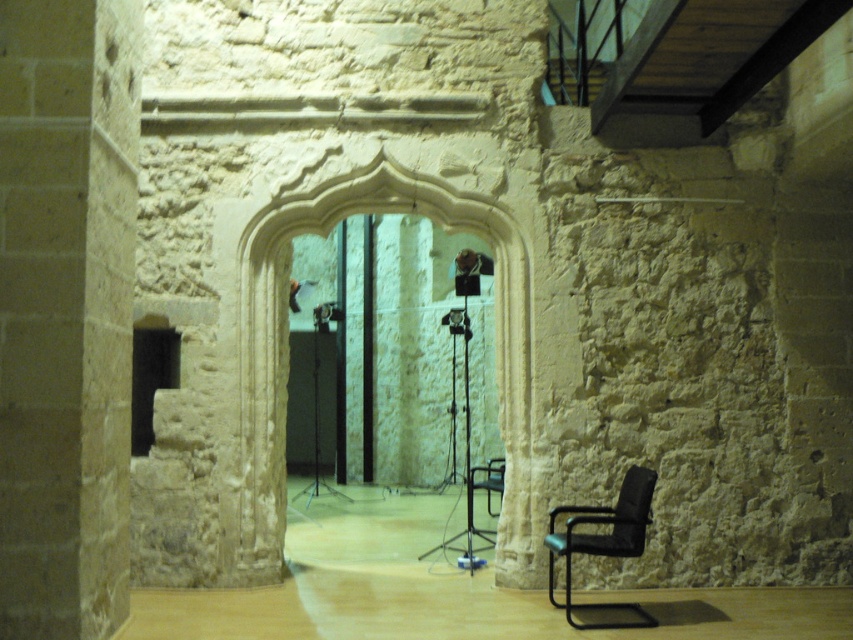
Question: Is smooth stone pillar at left behind white stone archway at center?

Choices:
 (A) no
 (B) yes

Answer: (A)

Question: Which object is closer to the camera taking this photo?

Choices:
 (A) smooth stone pillar at left
 (B) black leather armchair at lower right
 (C) white stone archway at center

Answer: (A)

Question: Does white stone archway at center appear on the left side of black leather armchair at lower right?

Choices:
 (A) no
 (B) yes

Answer: (B)

Question: Which point is closer to the camera taking this photo?

Choices:
 (A) (525, 234)
 (B) (103, 406)

Answer: (B)

Question: Considering the real-world distances, which object is closest to the smooth stone pillar at left?

Choices:
 (A) black leather armchair at lower right
 (B) white stone archway at center

Answer: (B)

Question: Does smooth stone pillar at left have a lesser width compared to white stone archway at center?

Choices:
 (A) yes
 (B) no

Answer: (A)